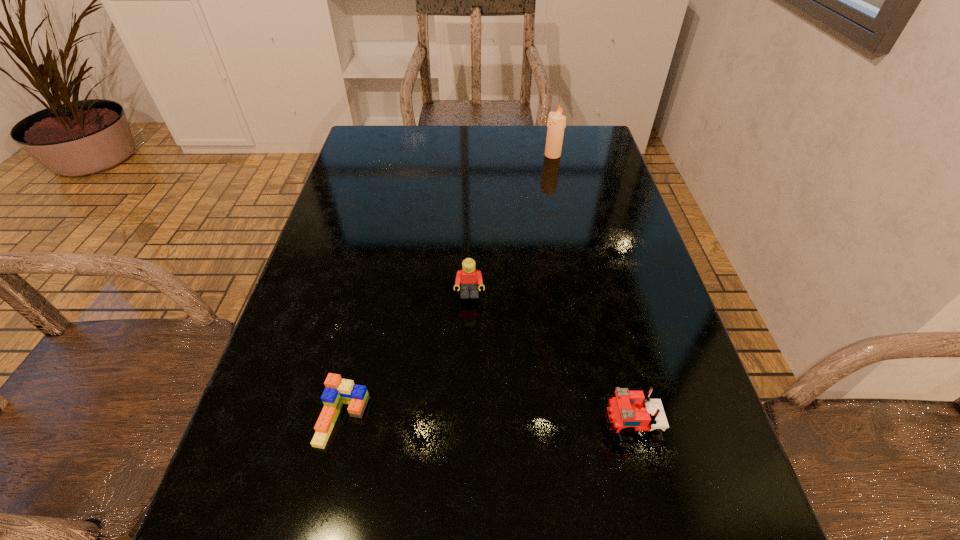
At what (x,y) coordinates should I click in order to perform the action: click on vacant space situated 0.250m on the front-facing side of the rightmost Lego. Please return your answer as a coordinate pair (x, y). The width and height of the screenshot is (960, 540). Looking at the image, I should click on (449, 426).

Image resolution: width=960 pixels, height=540 pixels. Find the location of `vacant space located on the front-facing side of the rightmost Lego`. vacant space located on the front-facing side of the rightmost Lego is located at coordinates (548, 426).

Image resolution: width=960 pixels, height=540 pixels. In order to click on vacant space located 0.370m on the right of the leftmost object in this screenshot , I will do `click(591, 419)`.

Identify the location of object at the far edge. This screenshot has height=540, width=960. (556, 124).

Where is `object that is at the left edge`? object that is at the left edge is located at coordinates (338, 391).

Locate an element on the screen. The height and width of the screenshot is (540, 960). candle that is at the right edge is located at coordinates (556, 124).

Where is `Lego present at the right edge`? This screenshot has height=540, width=960. Lego present at the right edge is located at coordinates (630, 410).

Locate an element on the screen. The height and width of the screenshot is (540, 960). object that is at the far right corner is located at coordinates (556, 124).

The image size is (960, 540). In order to click on free region at the far edge in this screenshot , I will do `click(468, 125)`.

This screenshot has height=540, width=960. In order to click on vacant region at the left edge of the desktop in this screenshot , I will do `click(277, 470)`.